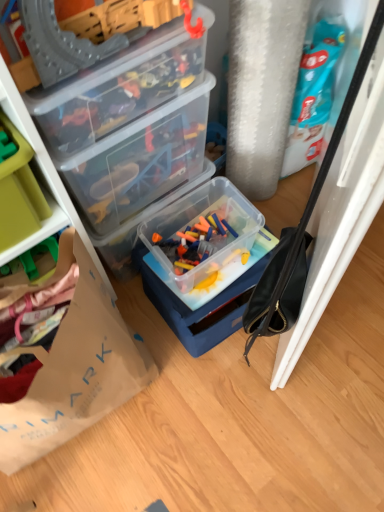
The image size is (384, 512). Find the location of `free point above translucent plastic container at center, the 3th box in the top-to-bottom sequence (from a real-world perspective)`. free point above translucent plastic container at center, the 3th box in the top-to-bottom sequence (from a real-world perspective) is located at coordinates (212, 259).